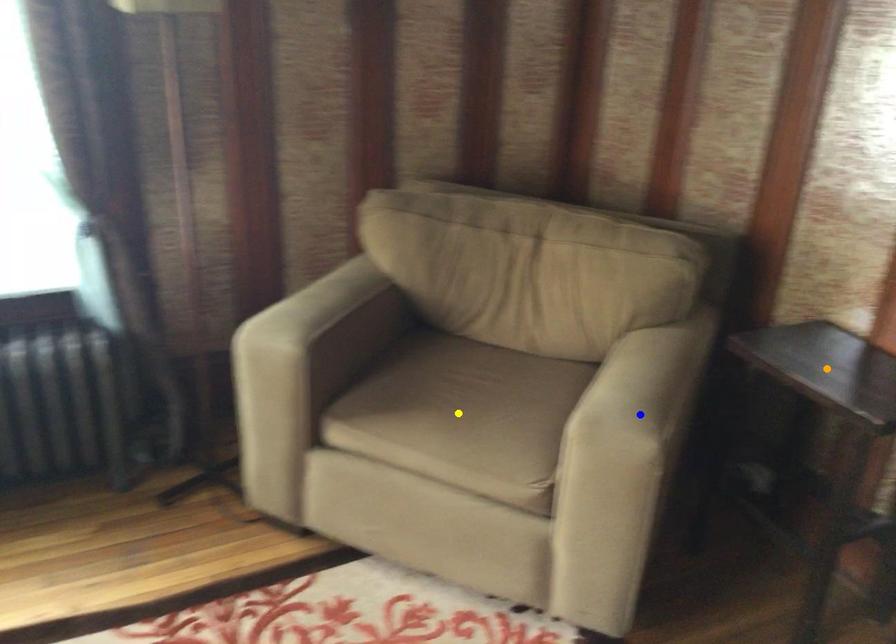
Order these from nearest to farthest:
- blue point
- orange point
- yellow point

yellow point → orange point → blue point